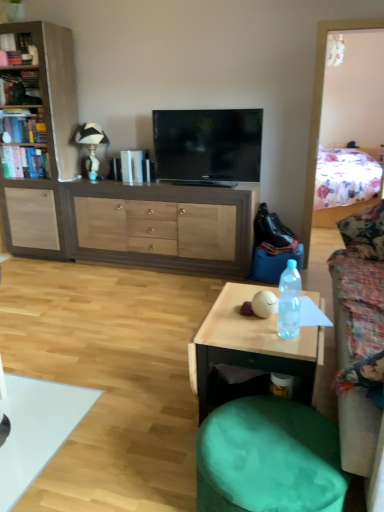
Locate an element on the screen. This screenshot has width=384, height=512. free spot in front of brown wood cabinet at center is located at coordinates (126, 311).